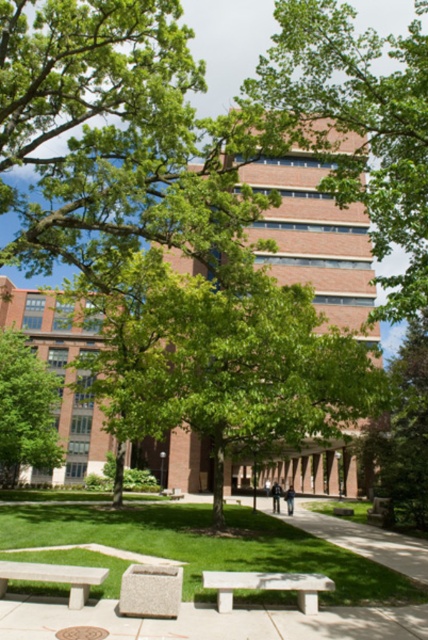
Looking at this image, you are a visitor approaching the campus building and see the green leafy tree at center and the green grass at lower center. Which object is closer to you as you walk towards the building?

The green leafy tree at center is closer to you than the green grass at lower center because it is further to the viewer.

You are a visitor standing at the entrance of the campus, facing the building. You notice two green leafy trees. Which tree, the green leafy tree at center or the green leafy tree at left, is shorter?

The green leafy tree at center is shorter than the green leafy tree at left.

Based on the photo, you are standing on the paved walkway and want to sit on a bench that is between the green leafy tree at center and the green leafy tree at left. Which tree is closer to the bench?

The green leafy tree at center is closer to the bench because it is nearer to the viewer compared to the green leafy tree at left.